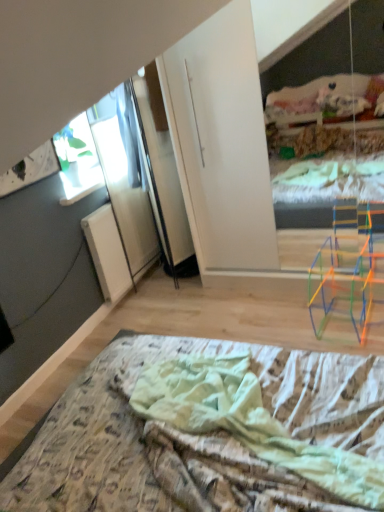
This screenshot has width=384, height=512. Describe the element at coordinates (208, 433) in the screenshot. I see `printed fabric bed at lower center` at that location.

At what (x,y) coordinates should I click in order to perform the action: click on printed fabric bed at lower center. Please return your answer as a coordinate pair (x, y). The height and width of the screenshot is (512, 384). Looking at the image, I should click on (208, 433).

Find the location of a particular element. The width and height of the screenshot is (384, 512). transparent glass window at upper left is located at coordinates (78, 161).

Image resolution: width=384 pixels, height=512 pixels. What do you see at coordinates (78, 161) in the screenshot? I see `transparent glass window at upper left` at bounding box center [78, 161].

Image resolution: width=384 pixels, height=512 pixels. Find the location of `printed fabric bed at lower center`. printed fabric bed at lower center is located at coordinates (208, 433).

Considering the positions of objects transparent glass window at upper left and printed fabric bed at lower center in the image provided, who is more to the left, transparent glass window at upper left or printed fabric bed at lower center?

Positioned to the left is transparent glass window at upper left.

Relative to printed fabric bed at lower center, is transparent glass window at upper left in front or behind?

Visually, transparent glass window at upper left is located behind printed fabric bed at lower center.

Considering the points (85, 131) and (88, 464), which point is behind, point (85, 131) or point (88, 464)?

The point (85, 131) is farther from the camera.

From the image's perspective, which object appears higher, transparent glass window at upper left or printed fabric bed at lower center?

transparent glass window at upper left appears higher in the image.

From a real-world perspective, is transparent glass window at upper left located higher than printed fabric bed at lower center?

Correct, in the physical world, transparent glass window at upper left is higher than printed fabric bed at lower center.

Between transparent glass window at upper left and printed fabric bed at lower center, which one has smaller width?

With smaller width is transparent glass window at upper left.

Is transparent glass window at upper left taller than printed fabric bed at lower center?

Indeed, transparent glass window at upper left has a greater height compared to printed fabric bed at lower center.

Between transparent glass window at upper left and printed fabric bed at lower center, which one has larger size?

Bigger between the two is printed fabric bed at lower center.

Based on the photo, can we say transparent glass window at upper left lies outside printed fabric bed at lower center?

transparent glass window at upper left lies outside printed fabric bed at lower center's area.

Consider the image. Is the surface of transparent glass window at upper left in direct contact with printed fabric bed at lower center?

No, transparent glass window at upper left is not next to printed fabric bed at lower center.

Is transparent glass window at upper left facing towards printed fabric bed at lower center?

No, transparent glass window at upper left does not turn towards printed fabric bed at lower center.

Measure the distance from transparent glass window at upper left to printed fabric bed at lower center.

transparent glass window at upper left is 5.04 feet away from printed fabric bed at lower center.

Identify the location of bed below the transparent glass window at upper left (from a real-world perspective). (208, 433).

Looking at this image, which is more to the right, printed fabric bed at lower center or transparent glass window at upper left?

From the viewer's perspective, printed fabric bed at lower center appears more on the right side.

Is printed fabric bed at lower center positioned behind transparent glass window at upper left?

No, it is in front of transparent glass window at upper left.

Considering the points (195, 362) and (94, 181), which point is in front, point (195, 362) or point (94, 181)?

The point (195, 362) is more forward.

From the image's perspective, who appears lower, printed fabric bed at lower center or transparent glass window at upper left?

printed fabric bed at lower center.

From a real-world perspective, is printed fabric bed at lower center positioned above or below transparent glass window at upper left?

From a real-world perspective, printed fabric bed at lower center is physically below transparent glass window at upper left.

Considering the sizes of objects printed fabric bed at lower center and transparent glass window at upper left in the image provided, who is thinner, printed fabric bed at lower center or transparent glass window at upper left?

transparent glass window at upper left.

Between printed fabric bed at lower center and transparent glass window at upper left, which one has more height?

transparent glass window at upper left is taller.

Which of these two, printed fabric bed at lower center or transparent glass window at upper left, is bigger?

printed fabric bed at lower center.

Is transparent glass window at upper left located within printed fabric bed at lower center?

No, transparent glass window at upper left is not surrounded by printed fabric bed at lower center.

Is the surface of printed fabric bed at lower center in direct contact with transparent glass window at upper left?

No, printed fabric bed at lower center is not next to transparent glass window at upper left.

Is printed fabric bed at lower center facing away from transparent glass window at upper left?

printed fabric bed at lower center does not have its back to transparent glass window at upper left.

Find the location of `bed in front of the transparent glass window at upper left`. bed in front of the transparent glass window at upper left is located at coordinates (208, 433).

Locate an element on the screen. The image size is (384, 512). window behind the printed fabric bed at lower center is located at coordinates (78, 161).

The image size is (384, 512). Identify the location of bed directly beneath the transparent glass window at upper left (from a real-world perspective). (208, 433).